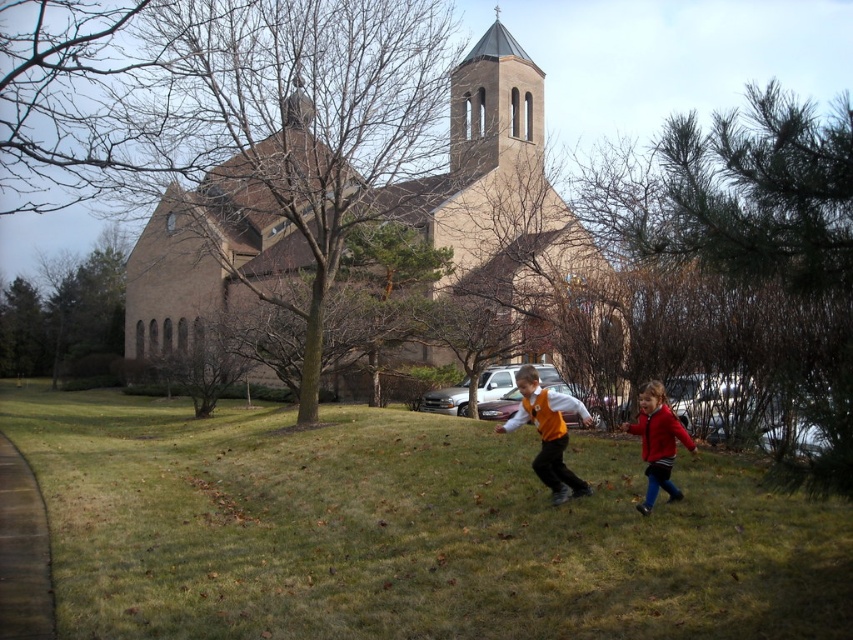
You are standing in front of the church and see the green grass at center and the orange matte vest at center. Which object is positioned to the left?

The green grass at center is positioned to the left of the orange matte vest at center.

You are standing at the entrance of the beige stone church at center. If you walk straight ahead, will you exit the church grounds immediately?

The beige stone church at center is located at point (368, 209), so walking straight ahead from the entrance might keep you within the church grounds as the coordinates suggest the church is centrally positioned.

You are standing in front of the beige stone church at center and want to find the orange matte vest at center. In which direction should you look relative to the church?

The beige stone church at center is located above the orange matte vest at center, so you should look downward from the church to find the vest.